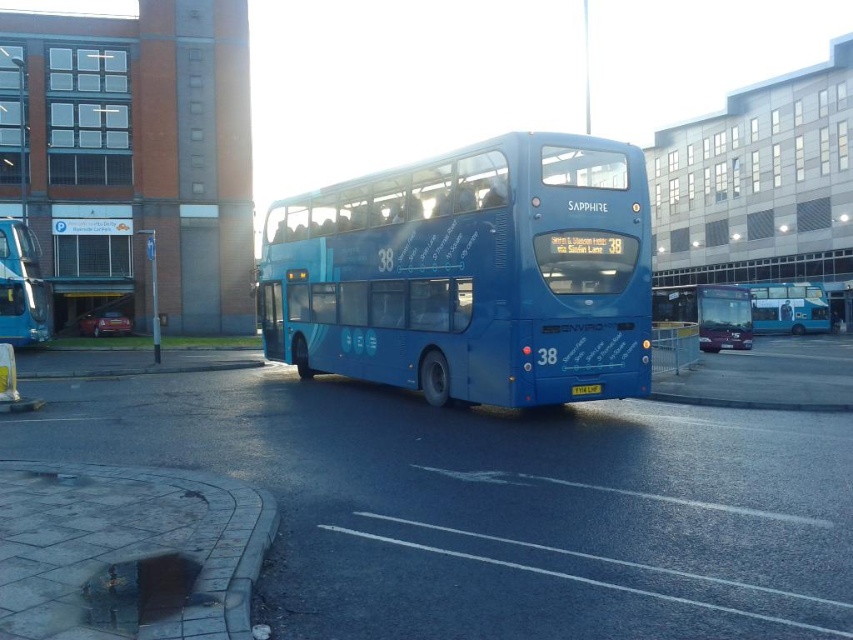
Question: Does matte blue bus at center have a lesser width compared to yellow metallic license plate at center?

Choices:
 (A) yes
 (B) no

Answer: (B)

Question: Is matte blue bus at left further to the viewer compared to blue matte bus at center?

Choices:
 (A) no
 (B) yes

Answer: (A)

Question: Which point is closer to the camera?

Choices:
 (A) matte blue bus at center
 (B) blue matte/deck bus at center
 (C) blue matte bus at center

Answer: (B)

Question: Is matte blue bus at center positioned at the back of blue matte bus at center?

Choices:
 (A) yes
 (B) no

Answer: (B)

Question: Among these points, which one is farthest from the camera?

Choices:
 (A) (608, 221)
 (B) (589, 394)
 (C) (6, 280)
 (D) (698, 342)

Answer: (C)

Question: Which point appears farthest from the camera in this image?

Choices:
 (A) (828, 323)
 (B) (741, 307)
 (C) (9, 224)

Answer: (A)